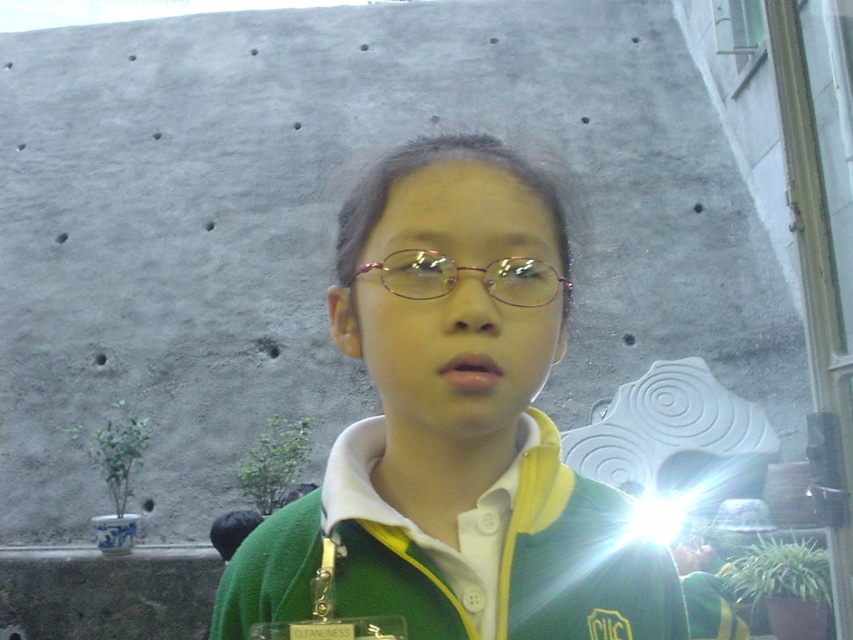
Does green matte sweater at center appear under pink metallic glasses at center?

Indeed, green matte sweater at center is positioned under pink metallic glasses at center.

Which is in front, point (315, 493) or point (428, 272)?

Point (428, 272) is more forward.

What are the coordinates of `green matte sweater at center` in the screenshot? It's located at (456, 428).

The image size is (853, 640). I want to click on green matte sweater at center, so click(456, 428).